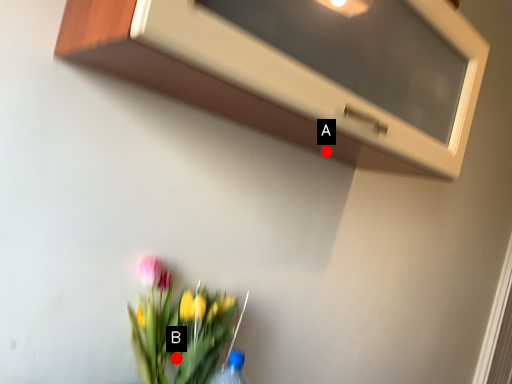
Question: Two points are circled on the image, labeled by A and B beside each circle. Which point appears closest to the camera in this image?

Choices:
 (A) A is closer
 (B) B is closer

Answer: (B)